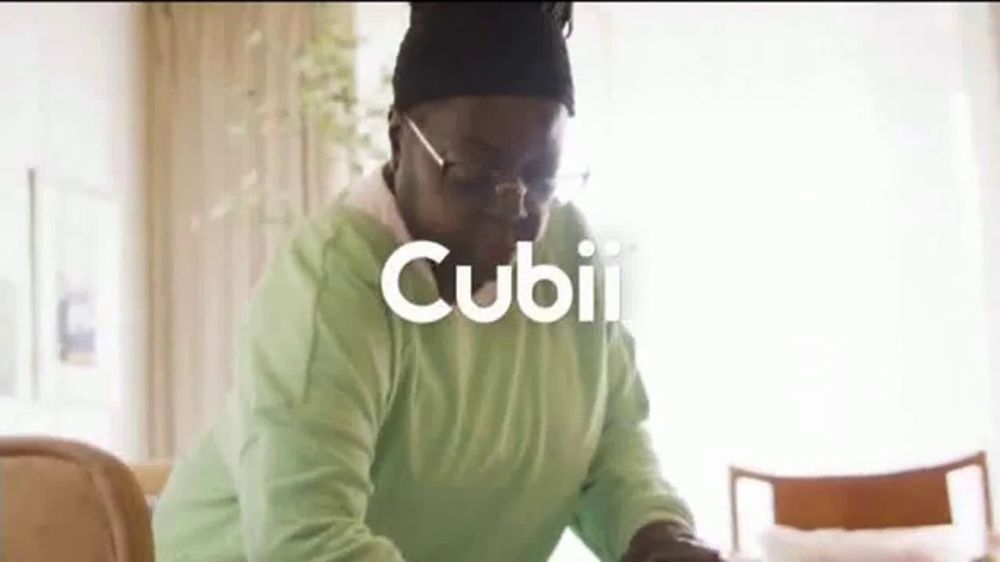
I want to click on plant, so click(x=321, y=90).